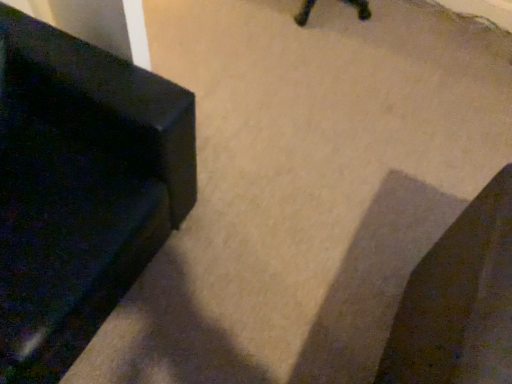
Describe the element at coordinates (80, 188) in the screenshot. I see `matte black tv at left` at that location.

Find the location of a particular element. The width and height of the screenshot is (512, 384). matte black tv at left is located at coordinates (80, 188).

This screenshot has width=512, height=384. I want to click on matte black tv at left, so (x=80, y=188).